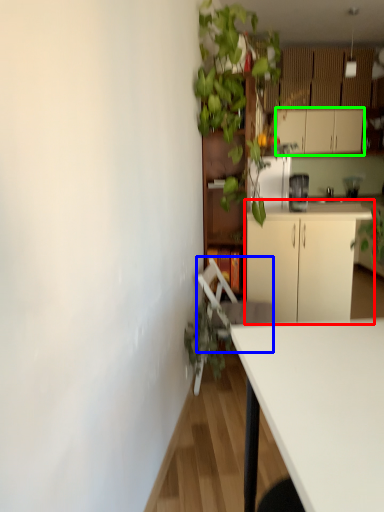
Question: Which object is positioned farthest from cabinetry (highlighted by a red box)? Select from swivel chair (highlighted by a blue box) and cabinetry (highlighted by a green box).

Choices:
 (A) swivel chair
 (B) cabinetry

Answer: (B)